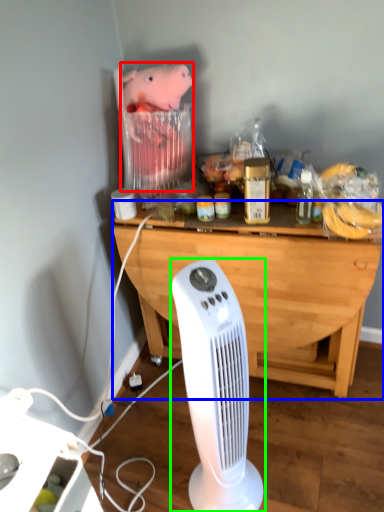
Question: Which is farther away from animal (highlighted by a red box)? desk (highlighted by a blue box) or home appliance (highlighted by a green box)?

Choices:
 (A) desk
 (B) home appliance

Answer: (B)